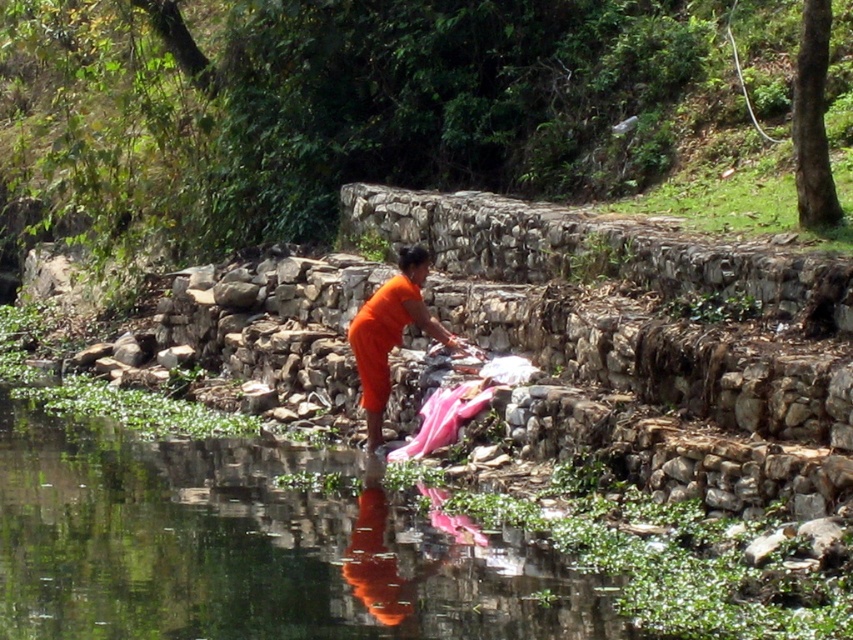
How far apart are orange fabric at center and orange matte cloth at center?

orange fabric at center is 2.16 inches away from orange matte cloth at center.

Can you confirm if orange fabric at center is shorter than orange matte cloth at center?

In fact, orange fabric at center may be taller than orange matte cloth at center.

What do you see at coordinates (390, 332) in the screenshot? I see `orange fabric at center` at bounding box center [390, 332].

I want to click on orange fabric at center, so click(390, 332).